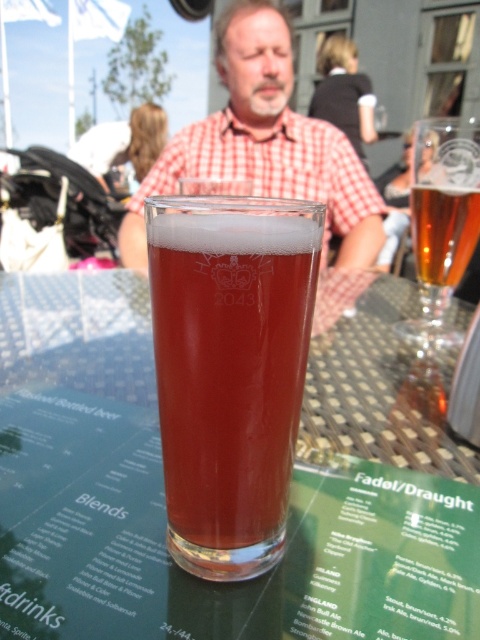
You are at a bar and want to order a drink. The bartender points to the menu on the table and mentions the drink you want is located at point (163,493). Based on the scene, what is the drink you want?

The point (163,493) corresponds to the translucent glass at center, so the drink you want is the translucent glass at center.

You are a bartender who needs to reach the translucent amber glass at center to refill it. Your hand is currently 8 inches away from the glass. Can you safely reach it without moving your arm further than 8 inches?

The translucent amber glass at center is only 6.29 inches away from the viewer, which is within the 8 inches reach of your hand. Therefore, you can safely reach it without extending your arm beyond 8 inches.

You are a bartender who needs to place a 10 inch long bottle of wine between the translucent glass at center and the clear glass beer at upper right. Is there enough space between them to fit the bottle?

The distance between the translucent glass at center and the clear glass beer at upper right is 8.00 inches. Since the bottle is 10 inches long, it cannot fit in the space between them.